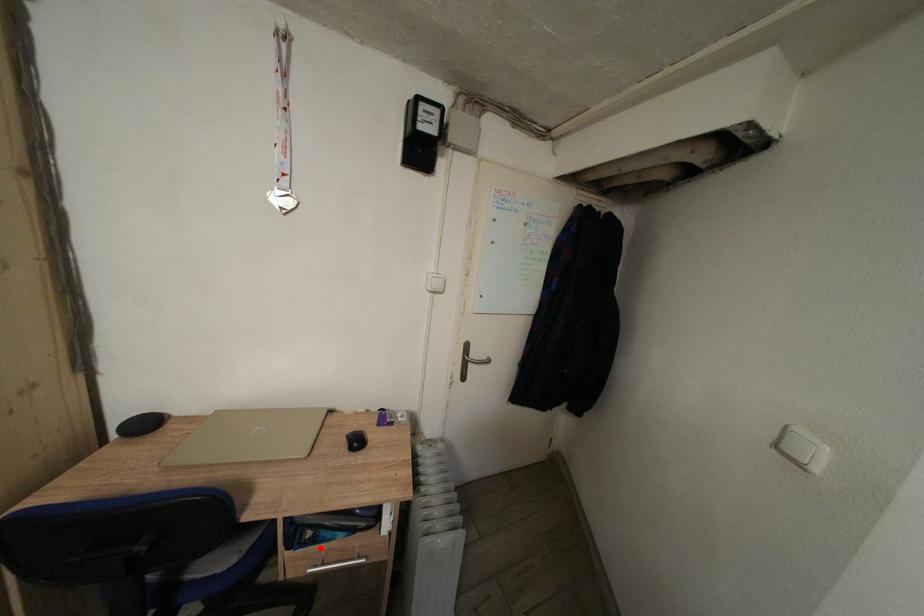
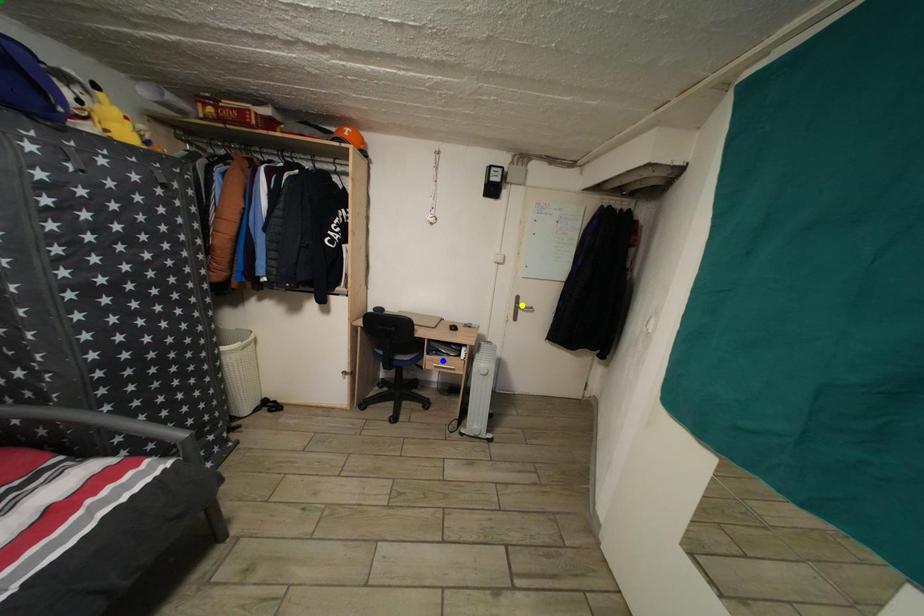
Question: I am providing you with two images of the same scene from different viewpoints. A red point is marked on the first image. You are given multiple points on the second image. Which spot in image 2 lines up with the point in image 1?

Choices:
 (A) green point
 (B) yellow point
 (C) blue point

Answer: (C)